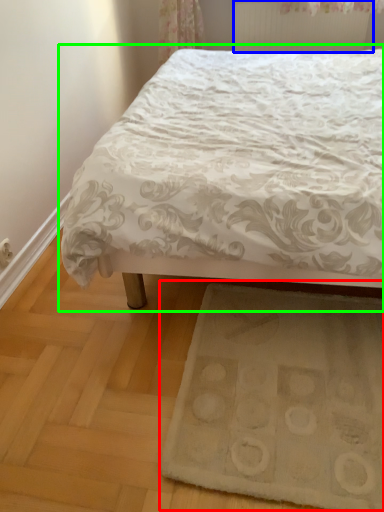
Question: Which object is positioned closest to doormat (highlighted by a red box)? Select from radiator (highlighted by a blue box) and bed (highlighted by a green box).

Choices:
 (A) radiator
 (B) bed

Answer: (B)